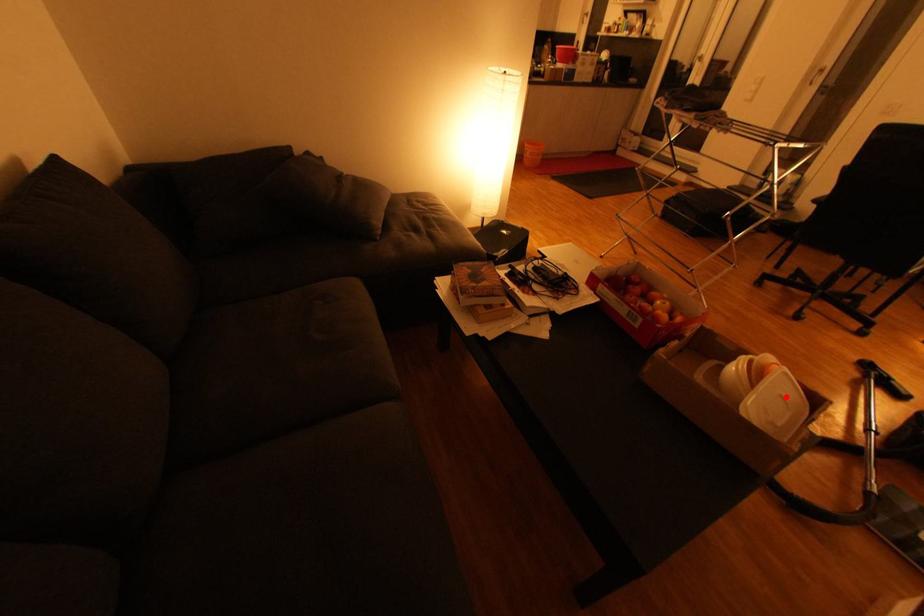
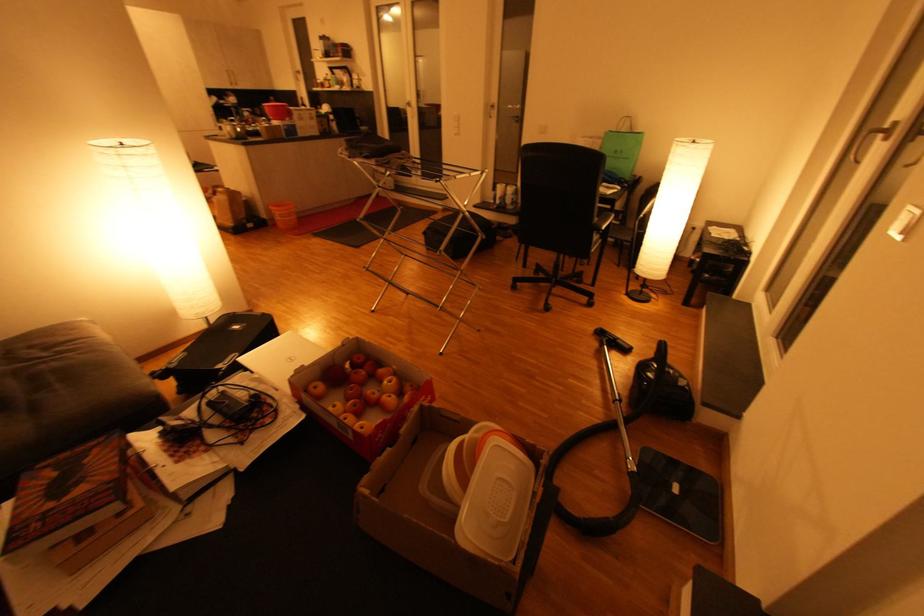
The point at the highlighted location is marked in the first image. Where is the corresponding point in the second image?

(504, 479)